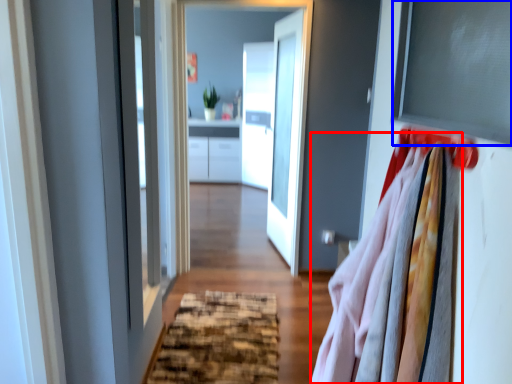
Question: Among these objects, which one is farthest to the camera, clothing (highlighted by a red box) or window screen (highlighted by a blue box)?

Choices:
 (A) clothing
 (B) window screen

Answer: (B)